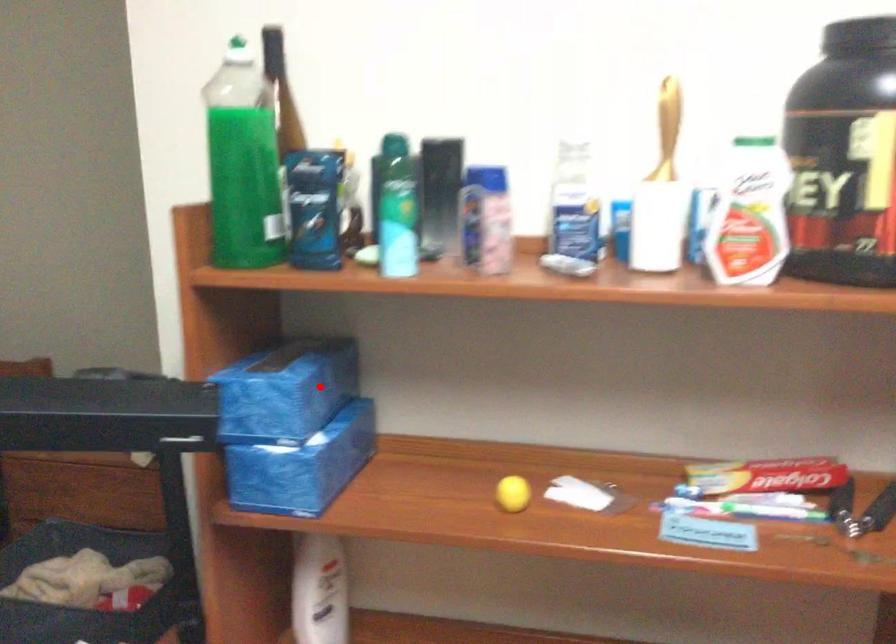
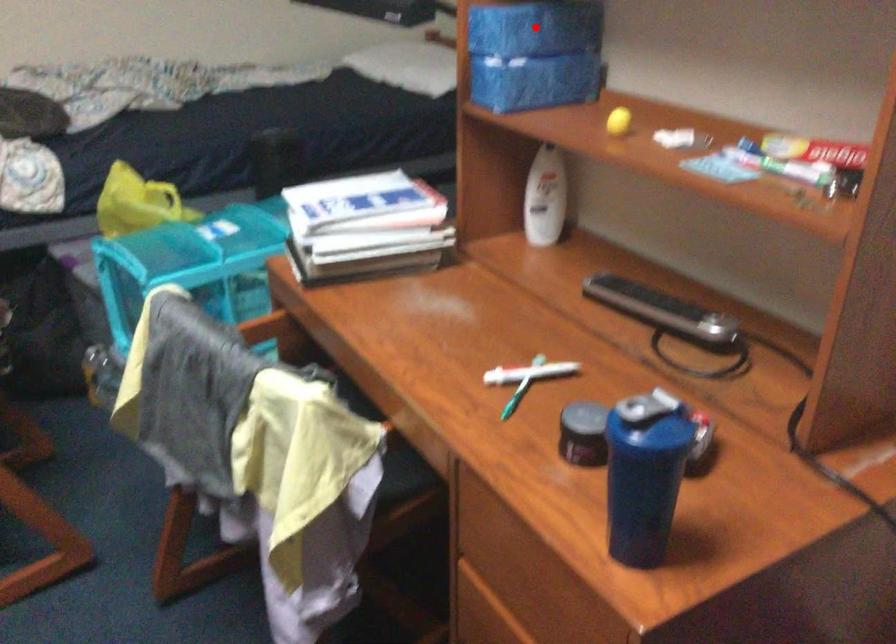
I am providing you with two images of the same scene from different viewpoints. A red point is marked on the first image and another point is marked on the second image. Are the points marked in image1 and image2 representing the same 3D position?

Yes